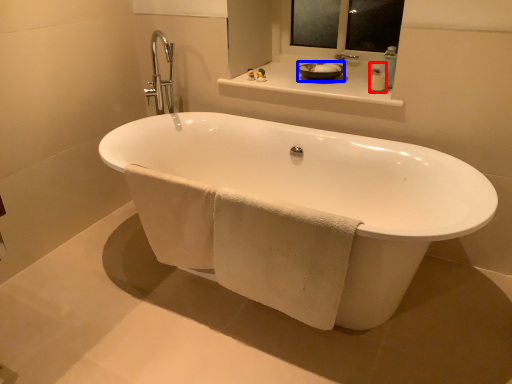
Question: Which of the following is the closest to the observer, soap dispenser (highlighted by a red box) or basin (highlighted by a blue box)?

Choices:
 (A) soap dispenser
 (B) basin

Answer: (A)